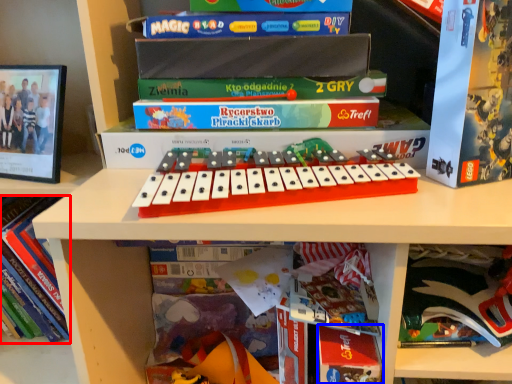
Question: Which object is closer to the camera taking this photo, book (highlighted by a red box) or paperback book (highlighted by a blue box)?

Choices:
 (A) book
 (B) paperback book

Answer: (B)